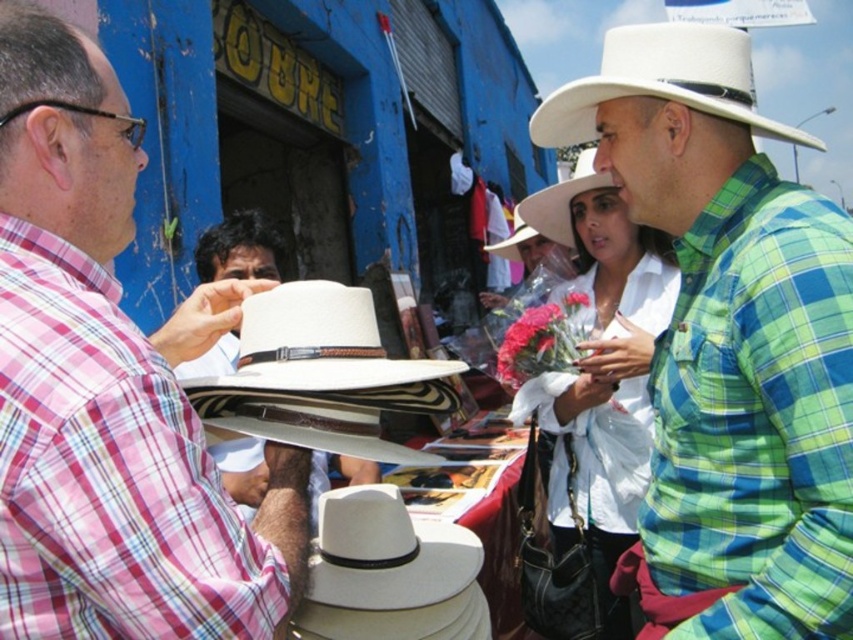
Which of these two, white matte cowboy hat at upper center or white matte cowboy hat at center, stands shorter?

white matte cowboy hat at center

Between point (753, 124) and point (544, 208), which one is positioned in front?

Point (753, 124) is in front.

Find the location of a particular element. The width and height of the screenshot is (853, 640). white matte cowboy hat at upper center is located at coordinates pyautogui.click(x=663, y=81).

Does white woven cowboy hat at center appear on the left side of white felt cowboy hat at center?

Yes, white woven cowboy hat at center is to the left of white felt cowboy hat at center.

Does white woven cowboy hat at center lie behind white felt cowboy hat at center?

No.

Is point (364, 291) farther from camera compared to point (383, 586)?

No, it is in front of (383, 586).

Where is `white woven cowboy hat at center`? Image resolution: width=853 pixels, height=640 pixels. white woven cowboy hat at center is located at coordinates (317, 342).

Can you confirm if matte white hat at left is smaller than white matte cowboy hat at upper center?

Correct, matte white hat at left occupies less space than white matte cowboy hat at upper center.

Which is behind, point (65, 38) or point (595, 80)?

Positioned behind is point (595, 80).

The height and width of the screenshot is (640, 853). Identify the location of matte white hat at left. (111, 388).